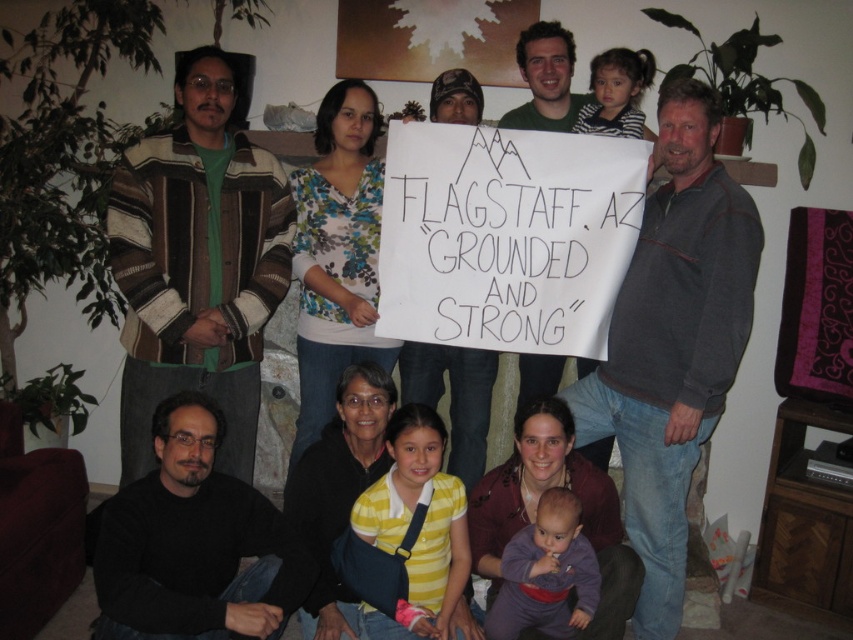
Can you confirm if gray fleece sweater at right is positioned to the left of black matte shirt at lower left?

Incorrect, gray fleece sweater at right is not on the left side of black matte shirt at lower left.

Is point (631, 298) positioned behind point (299, 582)?

Yes, point (631, 298) is behind point (299, 582).

Locate an element on the screen. This screenshot has height=640, width=853. gray fleece sweater at right is located at coordinates (672, 342).

Can you confirm if gray fleece sweater at right is positioned to the left of purple soft baby at lower center?

In fact, gray fleece sweater at right is to the right of purple soft baby at lower center.

Which is behind, point (660, 547) or point (614, 484)?

The point (614, 484) is more distant.

In order to click on gray fleece sweater at right in this screenshot , I will do `click(672, 342)`.

Who is taller, black matte shirt at lower left or yellow striped shirt at center?

With more height is yellow striped shirt at center.

Is black matte shirt at lower left taller than yellow striped shirt at center?

No, black matte shirt at lower left is not taller than yellow striped shirt at center.

Between point (294, 582) and point (403, 620), which one is positioned behind?

The point (403, 620) is more distant.

Where is `black matte shirt at lower left`? black matte shirt at lower left is located at coordinates (193, 544).